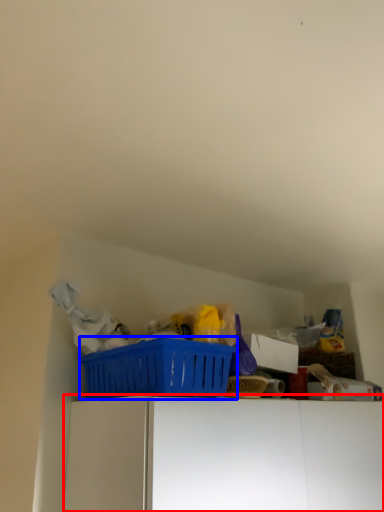
Question: Among these objects, which one is nearest to the camera, furniture (highlighted by a red box) or basket (highlighted by a blue box)?

Choices:
 (A) furniture
 (B) basket

Answer: (A)